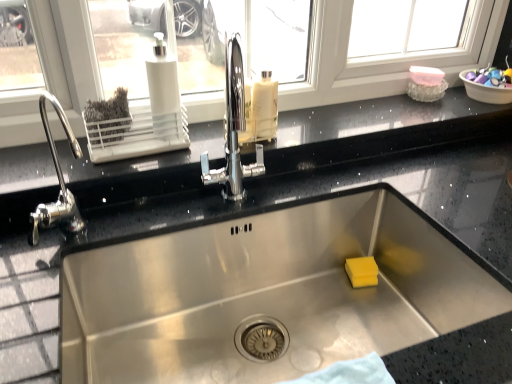
Question: Considering the relative sizes of white plastic soap dispenser at upper left and black granite countertop at upper center in the image provided, is white plastic soap dispenser at upper left wider than black granite countertop at upper center?

Choices:
 (A) no
 (B) yes

Answer: (A)

Question: Is white plastic soap dispenser at upper left beside black granite countertop at upper center?

Choices:
 (A) no
 (B) yes

Answer: (A)

Question: Can you confirm if white plastic soap dispenser at upper left is positioned to the right of black granite countertop at upper center?

Choices:
 (A) yes
 (B) no

Answer: (B)

Question: Is black granite countertop at upper center a part of white plastic soap dispenser at upper left?

Choices:
 (A) yes
 (B) no

Answer: (B)

Question: Is white plastic soap dispenser at upper left completely or partially outside of black granite countertop at upper center?

Choices:
 (A) no
 (B) yes

Answer: (B)

Question: Is white plastic soap dispenser at upper left facing towards black granite countertop at upper center?

Choices:
 (A) yes
 (B) no

Answer: (B)

Question: Is the position of black granite countertop at upper center less distant than that of plastic bowl at upper right?

Choices:
 (A) yes
 (B) no

Answer: (A)

Question: Is black granite countertop at upper center to the right of plastic bowl at upper right from the viewer's perspective?

Choices:
 (A) no
 (B) yes

Answer: (A)

Question: Could you tell me if black granite countertop at upper center is facing plastic bowl at upper right?

Choices:
 (A) yes
 (B) no

Answer: (B)

Question: From a real-world perspective, is black granite countertop at upper center physically above plastic bowl at upper right?

Choices:
 (A) yes
 (B) no

Answer: (B)

Question: Is black granite countertop at upper center outside of plastic bowl at upper right?

Choices:
 (A) no
 (B) yes

Answer: (B)

Question: Considering the relative sizes of black granite countertop at upper center and plastic bowl at upper right in the image provided, is black granite countertop at upper center taller than plastic bowl at upper right?

Choices:
 (A) yes
 (B) no

Answer: (B)

Question: Is there a large distance between translucent plastic bottle at center and black granite countertop at upper center?

Choices:
 (A) no
 (B) yes

Answer: (A)